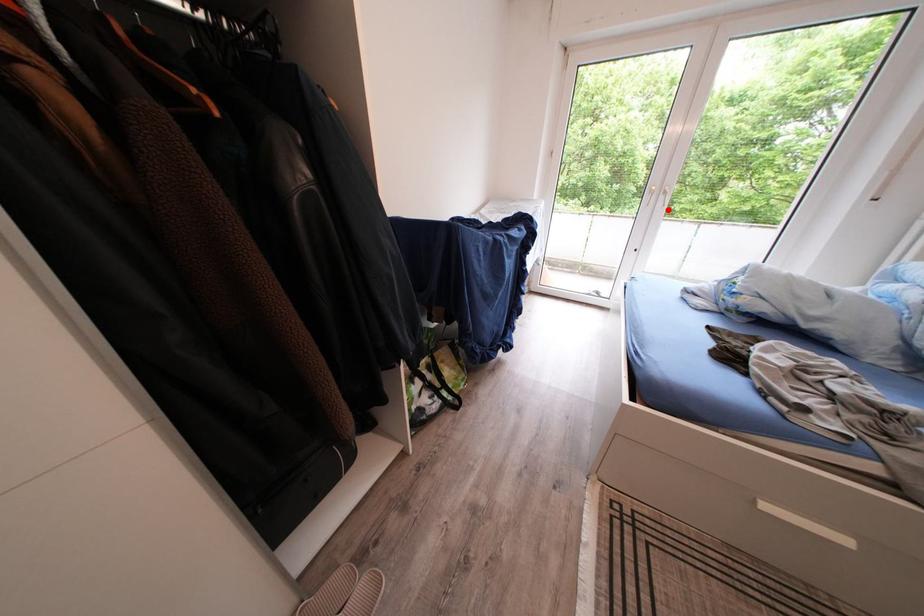
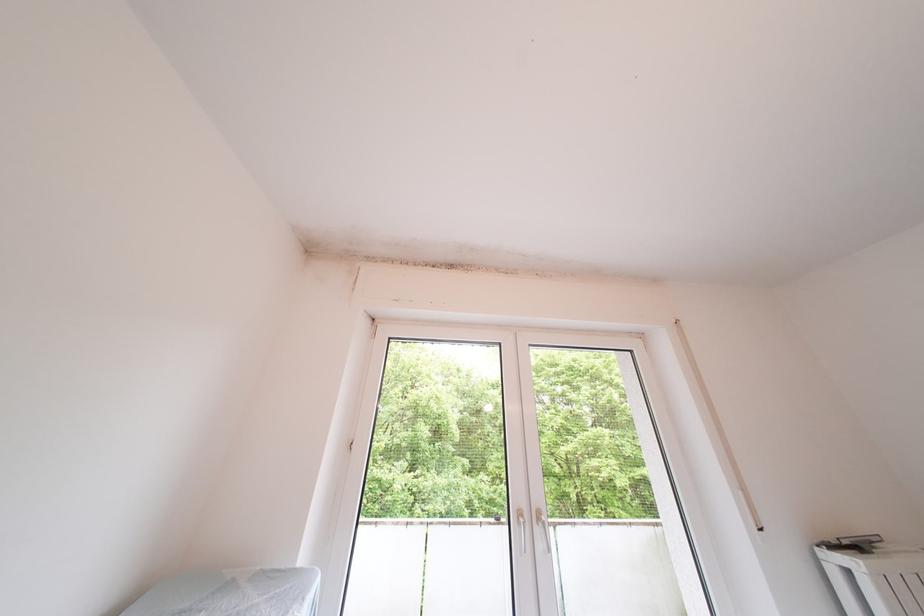
Find the pixel in the second image that matches the highlighted location in the first image.

(550, 552)